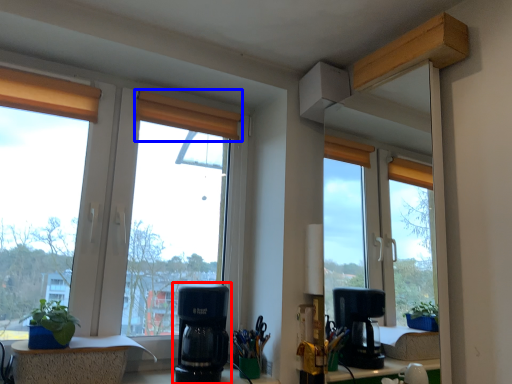
Question: Which of the following is the farthest to the observer, coffee maker (highlighted by a red box) or curtain (highlighted by a blue box)?

Choices:
 (A) coffee maker
 (B) curtain

Answer: (B)